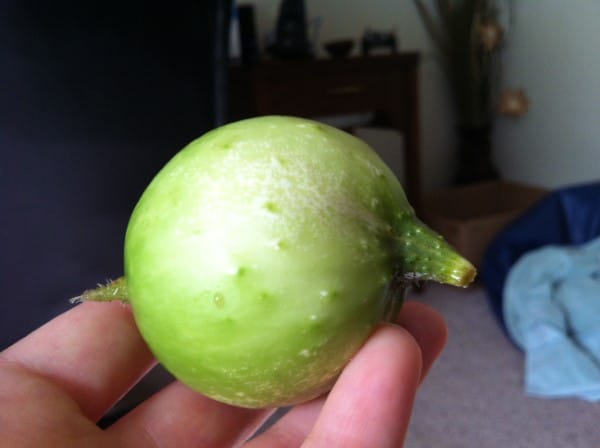
Locate an element on the screen. Image resolution: width=600 pixels, height=448 pixels. carpet is located at coordinates point(463,381).